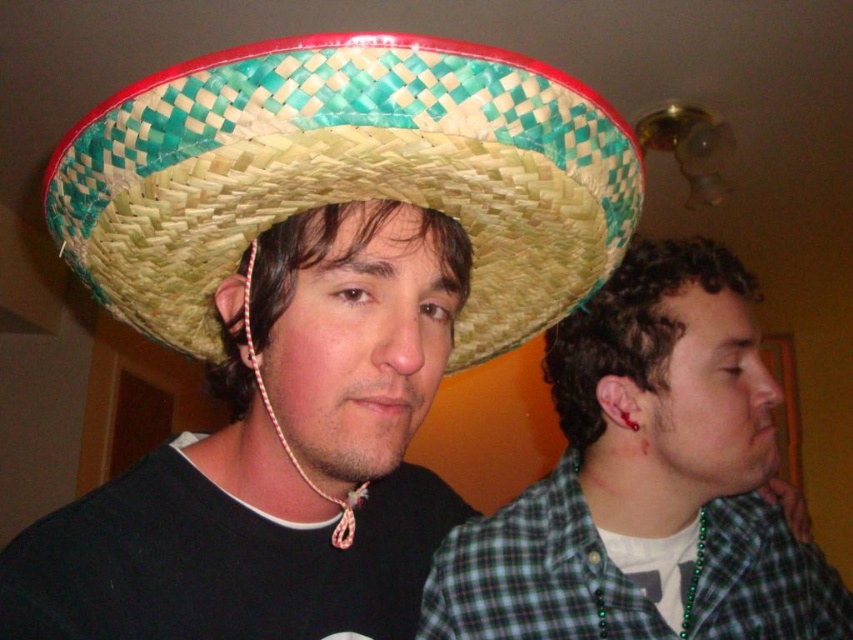
What do you see at coordinates (345, 176) in the screenshot? The height and width of the screenshot is (640, 853). I see `woven straw sombrero at center` at bounding box center [345, 176].

Who is taller, woven straw sombrero at center or green plaid shirt at right?

green plaid shirt at right is taller.

Locate an element on the screen. This screenshot has height=640, width=853. woven straw sombrero at center is located at coordinates (345, 176).